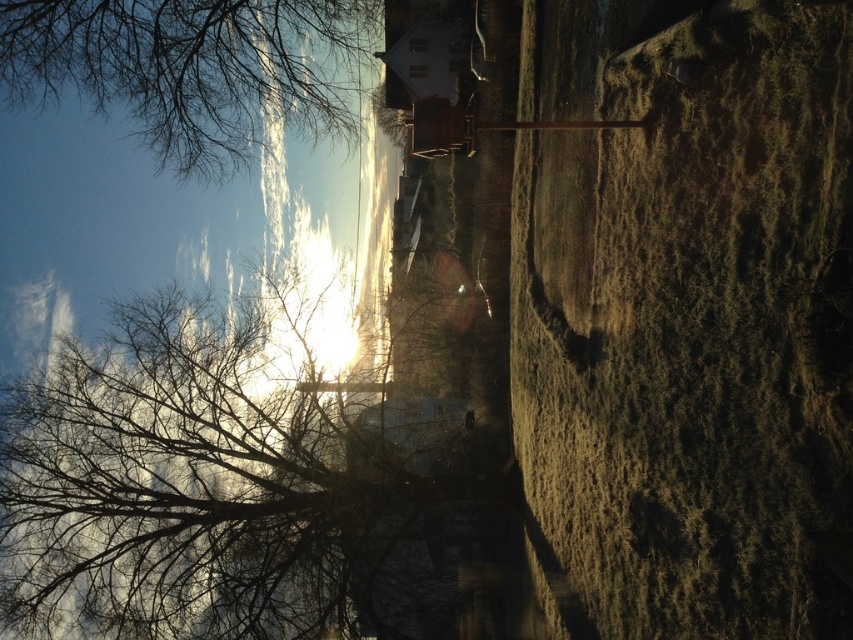
Between point (386, 468) and point (375, 3), which one is positioned in front?

Point (386, 468) is more forward.

Who is taller, bare branches at left or bare branches at upper left?

Standing taller between the two is bare branches at left.

Which is in front, point (96, 541) or point (148, 67)?

Point (148, 67) is in front.

Image resolution: width=853 pixels, height=640 pixels. Identify the location of bare branches at left. (224, 488).